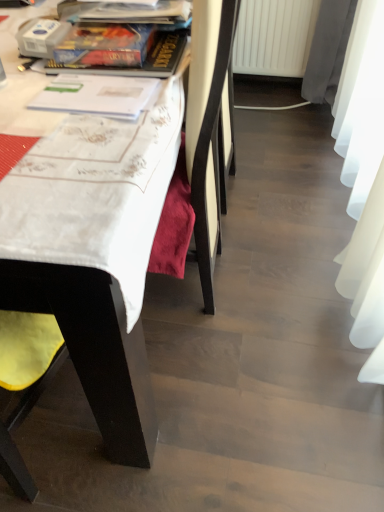
Question: Is white plastic radiator at lower center inside or outside of matte plastic book at upper center, arranged as the 2th book when ordered from the bottom?

Choices:
 (A) outside
 (B) inside

Answer: (A)

Question: Is white plastic radiator at lower center wider or thinner than matte plastic book at upper center, arranged as the 2th book when ordered from the bottom?

Choices:
 (A) wide
 (B) thin

Answer: (A)

Question: Which of these objects is positioned farthest from the white plastic radiator at lower center?

Choices:
 (A) hardcover book at upper left, which ranks as the 1th book in front-to-back order
 (B) matte plastic book at upper center, positioned as the 2th book in front-to-back order
 (C) yellow fabric chair at left

Answer: (C)

Question: Estimate the real-world distances between objects in this image. Which object is closer to the white plastic radiator at lower center?

Choices:
 (A) hardcover book at upper left, which is the 2th book in back-to-front order
 (B) yellow fabric chair at left
 (C) matte plastic book at upper center, placed as the first book when sorted from top to bottom

Answer: (C)